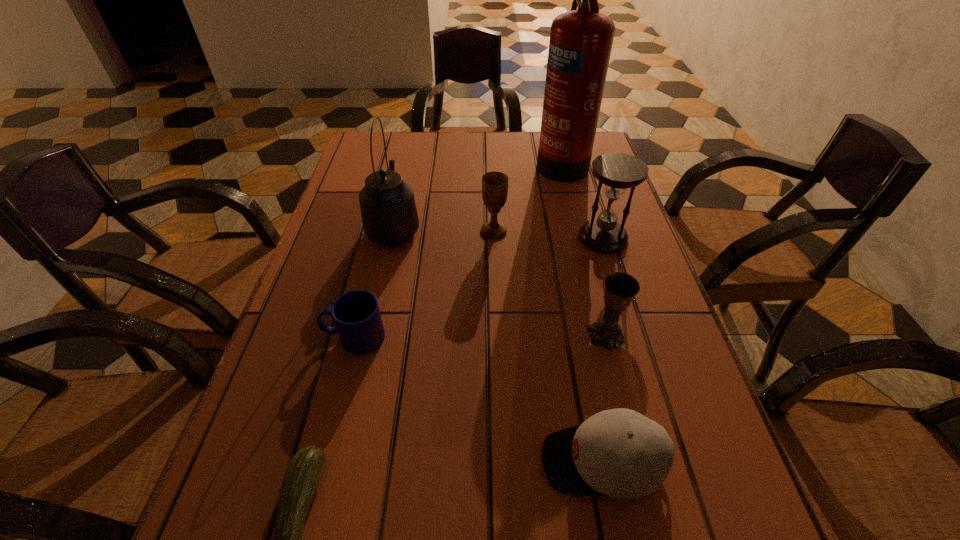
You are a GUI agent. You are given a task and a screenshot of the screen. Output one action in this format:
    pyautogui.click(x=<x>, y=<y>)
    Task: Click on the free space located on the front-facing side of the baseball cap
    The height and width of the screenshot is (540, 960).
    Given the screenshot: What is the action you would take?
    pyautogui.click(x=478, y=461)

At what (x,y) coordinates should I click in order to perform the action: click on object located at the far edge. Please return your answer as a coordinate pair (x, y). The height and width of the screenshot is (540, 960). Looking at the image, I should click on (581, 40).

Where is `kettle present at the left edge`? This screenshot has width=960, height=540. kettle present at the left edge is located at coordinates (389, 215).

You are a GUI agent. You are given a task and a screenshot of the screen. Output one action in this format:
    pyautogui.click(x=<x>, y=<y>)
    Task: Click on the mug that is at the left edge
    The width and height of the screenshot is (960, 540).
    Given the screenshot: What is the action you would take?
    pyautogui.click(x=356, y=314)

Where is `fire extinguisher that is at the right edge`? This screenshot has width=960, height=540. fire extinguisher that is at the right edge is located at coordinates (581, 40).

This screenshot has height=540, width=960. I want to click on hourglass situated at the right edge, so click(x=617, y=171).

Find the location of a particular element. The width and height of the screenshot is (960, 540). chalice that is at the right edge is located at coordinates (620, 288).

Where is `baseball cap that is positioned at the right edge`? baseball cap that is positioned at the right edge is located at coordinates (620, 453).

Identify the location of object present at the far right corner. Image resolution: width=960 pixels, height=540 pixels. (581, 40).

You are a GUI agent. You are given a task and a screenshot of the screen. Output one action in this format:
    pyautogui.click(x=<x>, y=<y>)
    Task: Click on the vacant space at the far edge of the desktop
    Image resolution: width=960 pixels, height=540 pixels.
    Given the screenshot: What is the action you would take?
    pyautogui.click(x=462, y=145)